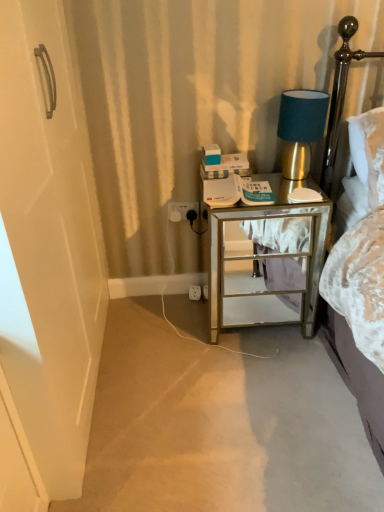
Question: From a real-world perspective, is white plastic electric outlet at lower center, marked as the 2th electric outlet in a top-to-bottom arrangement, above or below white plastic electric outlet at lower center, the second electric outlet viewed from the back?

Choices:
 (A) above
 (B) below

Answer: (B)

Question: Considering the positions of point (190, 297) and point (185, 218), is point (190, 297) closer or farther from the camera than point (185, 218)?

Choices:
 (A) closer
 (B) farther

Answer: (B)

Question: Which is nearer to the white plastic electric outlet at lower center, arranged as the 2th electric outlet when viewed from the front?

Choices:
 (A) white plastic electric outlet at lower center, the 1th electric outlet when ordered from top to bottom
 (B) mirrored glass nightstand at right
 (C) gold metallic table lamp at upper right
 (D) metallic gold headboard at upper right

Answer: (A)

Question: Which is nearer to the gold metallic table lamp at upper right?

Choices:
 (A) metallic gold headboard at upper right
 (B) white plastic electric outlet at lower center, the 1th electric outlet when ordered from top to bottom
 (C) mirrored glass nightstand at right
 (D) white plastic electric outlet at lower center, which is counted as the 1th electric outlet, starting from the bottom

Answer: (A)